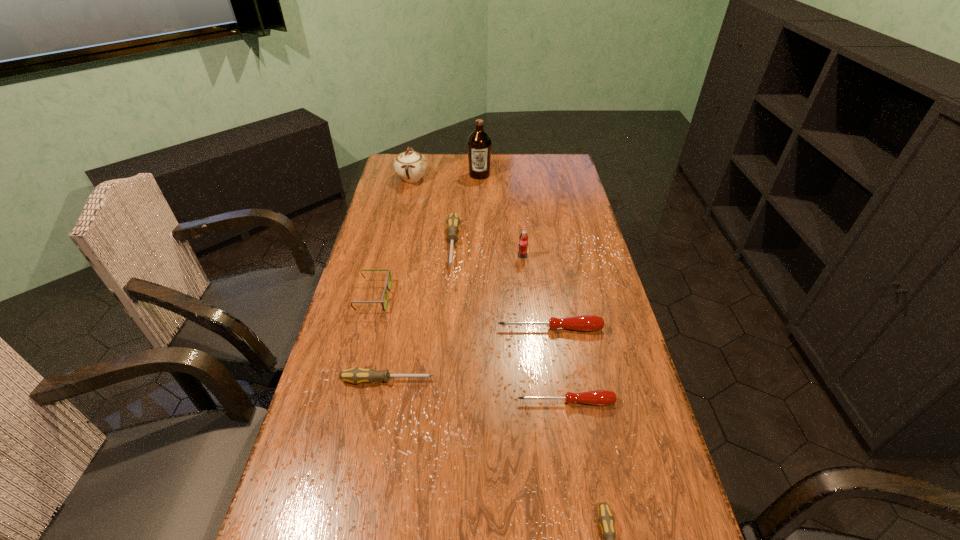
Where is `free area in between the farther red screwdriver and the fifth nearest object`? Image resolution: width=960 pixels, height=540 pixels. free area in between the farther red screwdriver and the fifth nearest object is located at coordinates (462, 313).

You are a GUI agent. You are given a task and a screenshot of the screen. Output one action in this format:
    pyautogui.click(x=<x>, y=<y>)
    Task: Click on the vacant region between the third tallest object and the brown olive oil
    The height and width of the screenshot is (540, 960).
    Given the screenshot: What is the action you would take?
    pyautogui.click(x=501, y=215)

Locate an element on the screen. The image size is (960, 540). vacant space in between the spectacles and the brown olive oil is located at coordinates (426, 235).

In order to click on vacant region between the fifth farthest object and the fifth object from left to right in this screenshot , I will do `click(426, 235)`.

In order to click on vacant point located between the third tallest object and the spectacles in this screenshot , I will do `click(448, 276)`.

This screenshot has height=540, width=960. In order to click on empty space that is in between the spectacles and the nearer red screwdriver in this screenshot , I will do `click(469, 349)`.

Locate an element on the screen. This screenshot has height=540, width=960. object that stands as the sixth closest to the nearest object is located at coordinates (523, 239).

Where is `object that stands as the seventh closest to the second nearest object`? object that stands as the seventh closest to the second nearest object is located at coordinates click(410, 166).

Image resolution: width=960 pixels, height=540 pixels. What are the coordinates of `screwdriver that stands as the second closest to the white chinaware` in the screenshot? It's located at (584, 322).

Identify which screwdriver is the fourth closest to the fifth object from right to left. Please provide its 2D coordinates. Your answer should be formatted as a tuple, i.e. [(x, y)], where the tuple contains the x and y coordinates of a point satisfying the conditions above.

[(597, 397)]